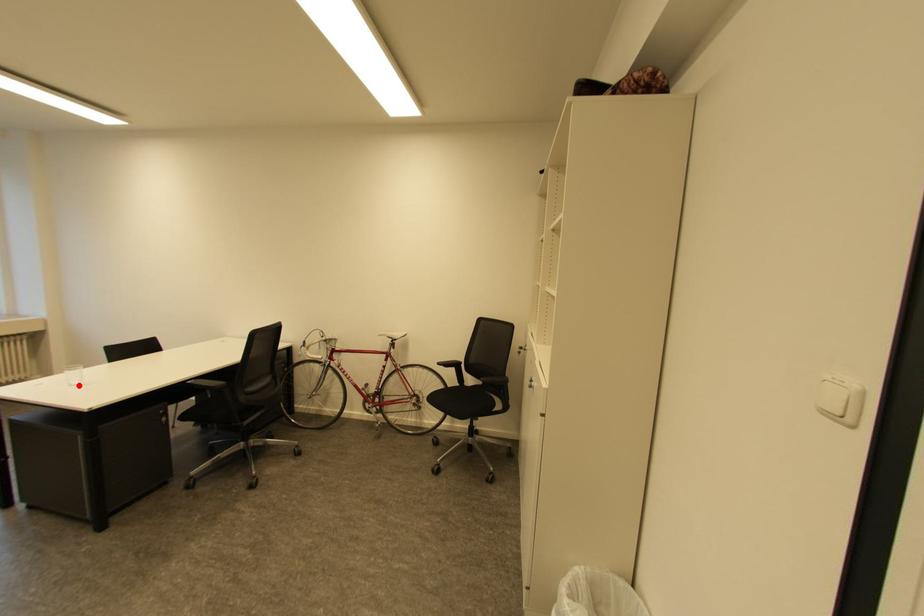
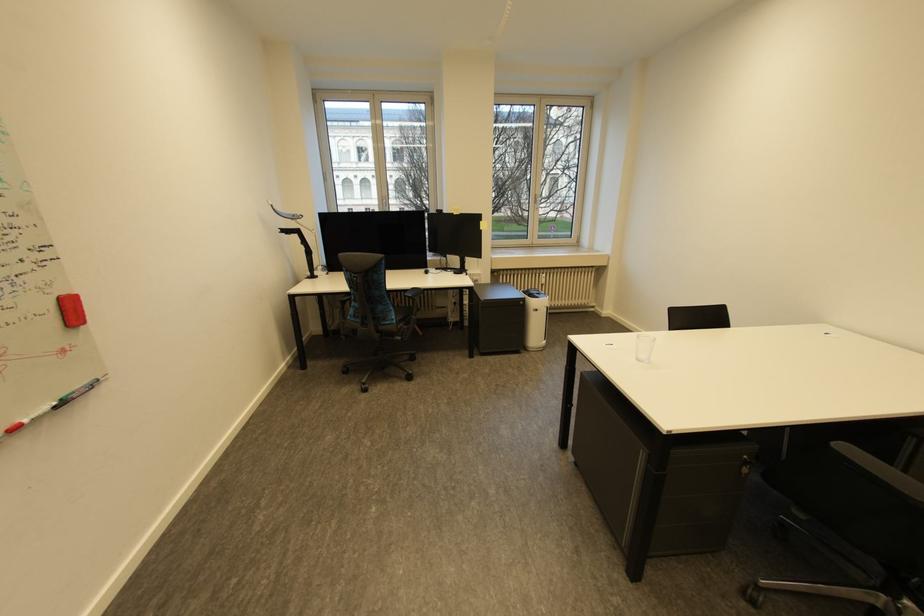
In the second image, find the point that corresponds to the highlighted location in the first image.

(646, 361)